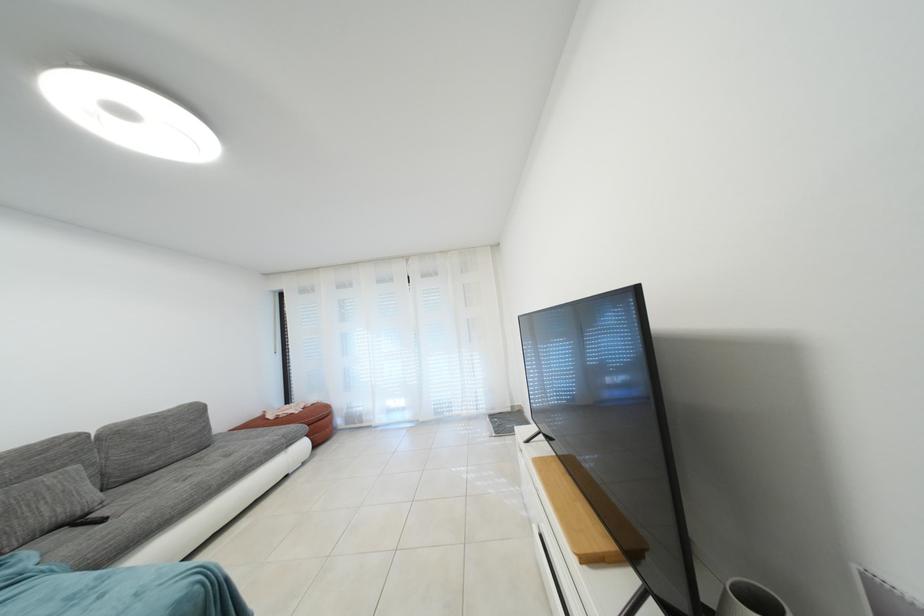
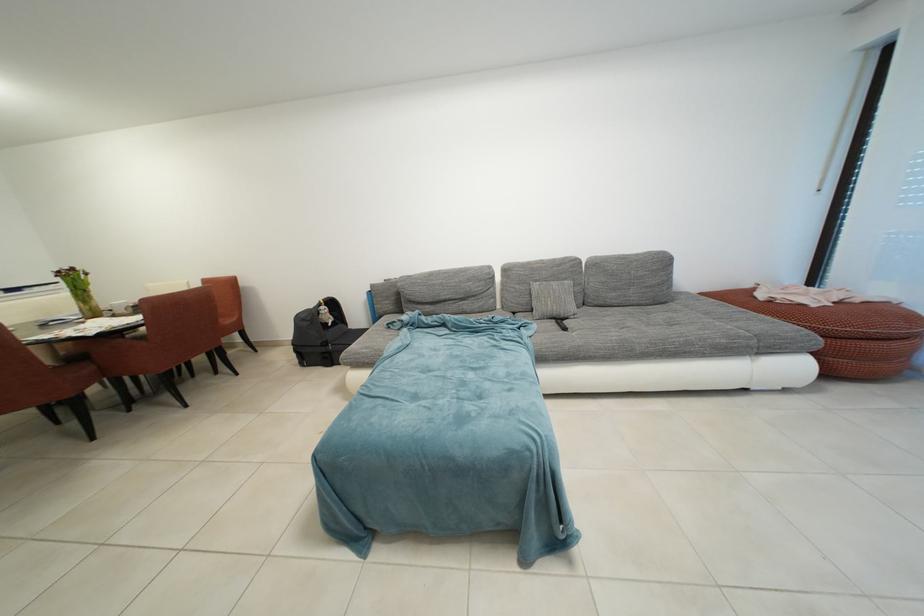
The point at [71,537] is marked in the first image. Where is the corresponding point in the second image?

(560, 328)